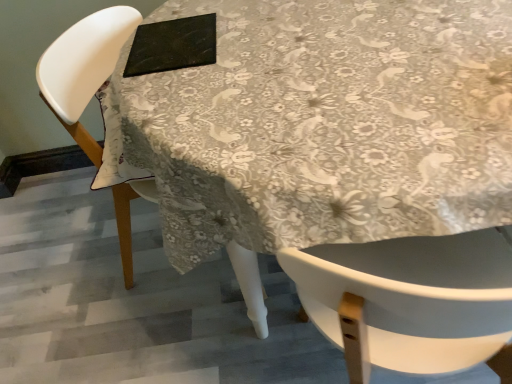
Question: From the image's perspective, is white glossy table at center located above or below black matte pad at upper center?

Choices:
 (A) below
 (B) above

Answer: (A)

Question: Relative to black matte pad at upper center, is white glossy table at center in front or behind?

Choices:
 (A) front
 (B) behind

Answer: (A)

Question: Which of these objects is positioned farthest from the white glossy table at center?

Choices:
 (A) white plastic chair at upper left
 (B) black matte pad at upper center

Answer: (A)

Question: Which of these objects is positioned farthest from the black matte pad at upper center?

Choices:
 (A) white plastic chair at upper left
 (B) white glossy table at center

Answer: (A)